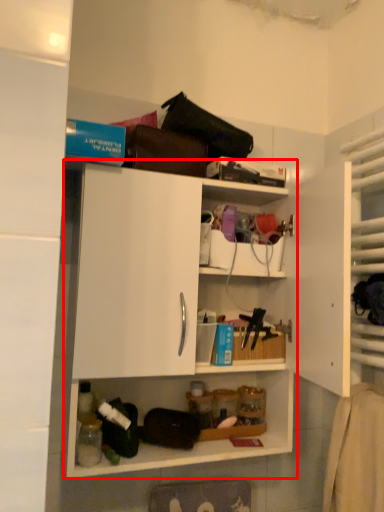
Question: Where is shelf (annotated by the red box) located in relation to shelf in the image?

Choices:
 (A) left
 (B) right

Answer: (A)